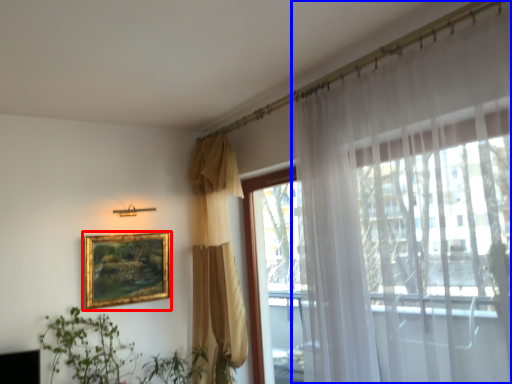
Question: Among these objects, which one is farthest to the camera, picture frame (highlighted by a red box) or curtain (highlighted by a blue box)?

Choices:
 (A) picture frame
 (B) curtain

Answer: (A)